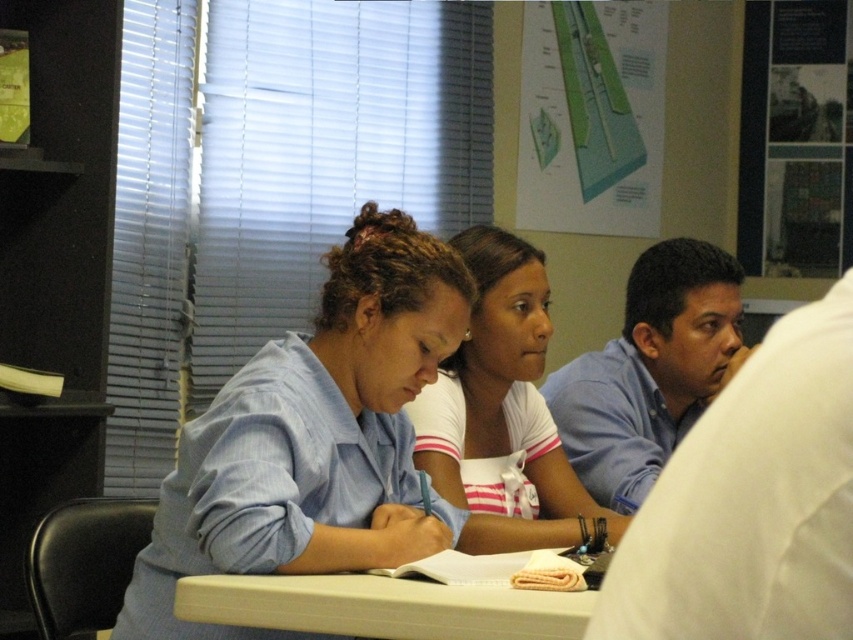
Between green paper at upper center and blue shirt at center, which one has less height?

Standing shorter between the two is blue shirt at center.

Is green paper at upper center smaller than blue shirt at center?

No, green paper at upper center is not smaller than blue shirt at center.

Who is more distant from viewer, (558,17) or (610,392)?

Positioned behind is point (558,17).

Image resolution: width=853 pixels, height=640 pixels. I want to click on green paper at upper center, so click(x=590, y=116).

Can you confirm if blue striped shirt at center is thinner than white striped shirt at center?

No.

Can you confirm if blue striped shirt at center is taller than white striped shirt at center?

Indeed, blue striped shirt at center has a greater height compared to white striped shirt at center.

Identify the location of blue striped shirt at center. (312, 436).

Where is `blue striped shirt at center`? The width and height of the screenshot is (853, 640). blue striped shirt at center is located at coordinates (312, 436).

Which is in front, point (506, 348) or point (422, 572)?

Point (422, 572)

Between white striped shirt at center and white plastic table at center, which one has more height?

With more height is white striped shirt at center.

Find the location of a particular element. white striped shirt at center is located at coordinates (503, 412).